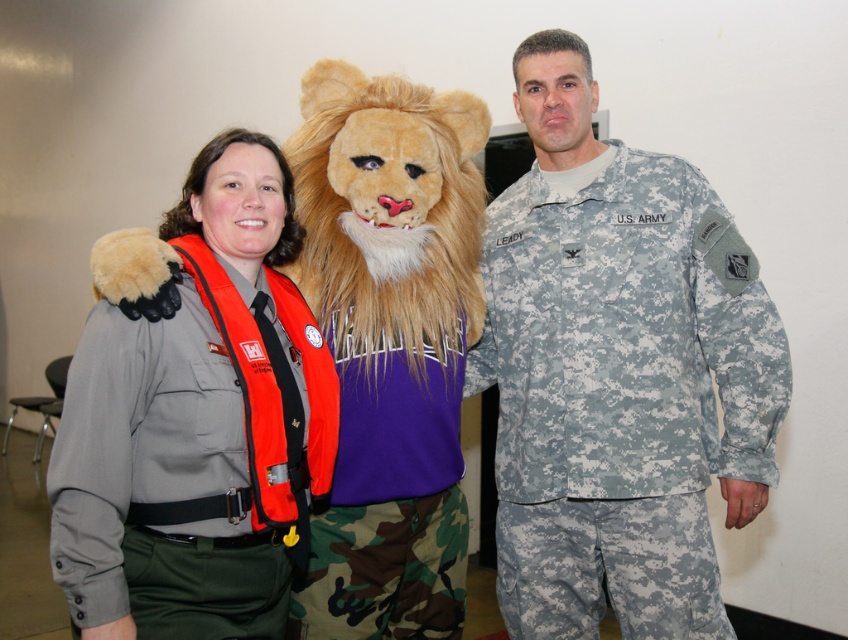
You are a photographer setting up for a group photo. You see the camouflage uniform at center and the gray fabric uniform at center. Which one is positioned more to the left?

The gray fabric uniform at center is positioned more to the left than the camouflage uniform at center.

You are a photographer trying to position two subjects in a photo. You have a camera that can only capture objects up to 2 meters wide. The camouflage uniform at center and the gray fabric uniform at center are both in the frame. Based on their widths, will both subjects fit within the camera frame if they stand side by side?

The camouflage uniform at center is wider than the gray fabric uniform at center. Since the camera can capture up to 2 meters, we need to know their combined width. However, the exact widths arenot provided, so we cannot determine if they will fit together.